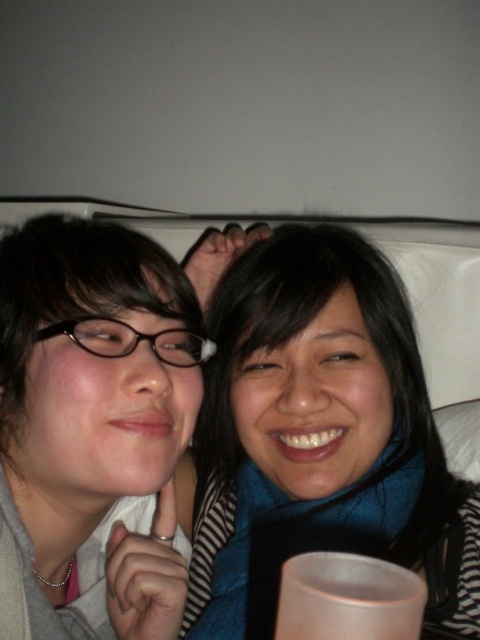
Does blue fabric scarf at upper center appear on the left side of white matte cup at lower center?

In fact, blue fabric scarf at upper center is to the right of white matte cup at lower center.

Is blue fabric scarf at upper center shorter than white matte cup at lower center?

In fact, blue fabric scarf at upper center may be taller than white matte cup at lower center.

Between point (412, 532) and point (325, 624), which one is positioned in front?

Positioned in front is point (325, 624).

Locate an element on the screen. The image size is (480, 640). blue fabric scarf at upper center is located at coordinates (320, 436).